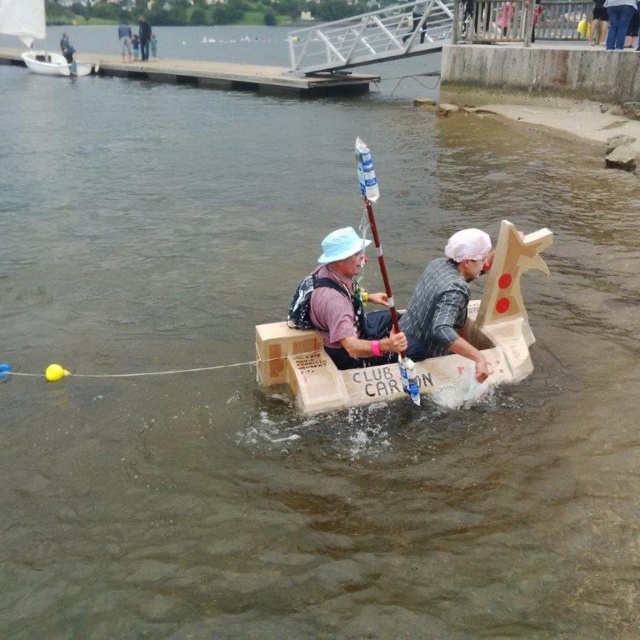
Question: In this image, where is matte cardboard boat at center located relative to white plastic boat at upper left?

Choices:
 (A) left
 (B) right

Answer: (B)

Question: Which is farther from the light blue fabric hat at center?

Choices:
 (A) white plastic paddle at center
 (B) brushed metal water at bottle left
 (C) light blue fabric shirt at upper center
 (D) cardboard boat at center

Answer: (A)

Question: Which point is closer to the camera taking this photo?

Choices:
 (A) (67, 44)
 (B) (124, 19)

Answer: (A)

Question: Is matte cardboard boat at center smaller than light blue fabric shirt at upper center?

Choices:
 (A) no
 (B) yes

Answer: (B)

Question: Can you confirm if light blue fabric hat at center is wider than brushed metal water at bottle left?

Choices:
 (A) yes
 (B) no

Answer: (B)

Question: Based on their relative distances, which object is farther from the light blue fabric shirt at upper center?

Choices:
 (A) white plastic paddle at center
 (B) brushed metal water at bottle left

Answer: (A)